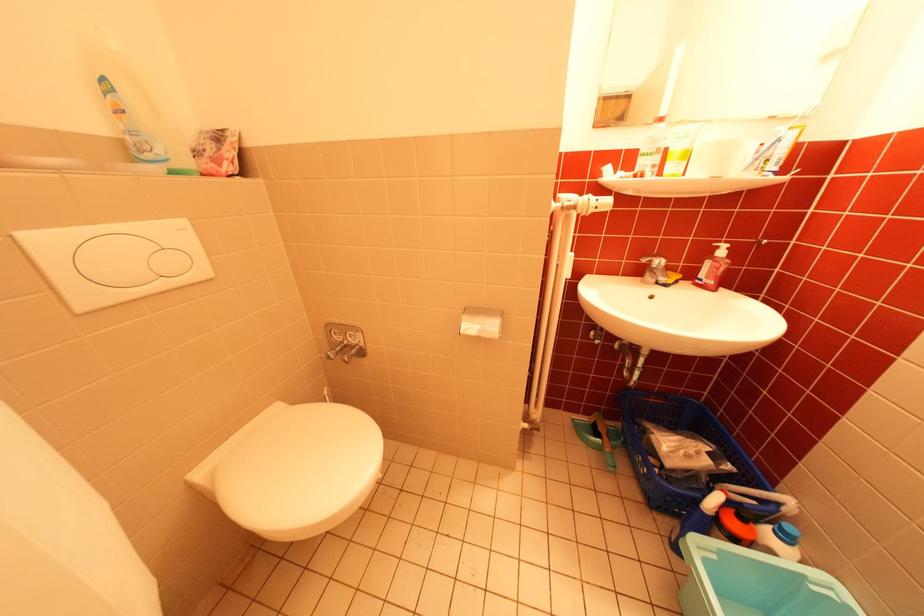
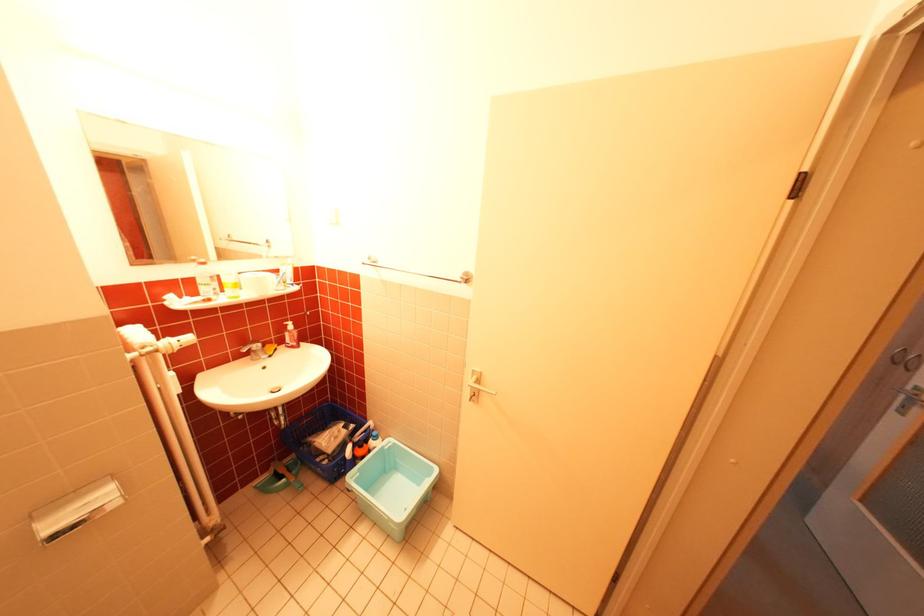
The point at [643,384] is marked in the first image. Where is the corresponding point in the second image?

(295, 428)